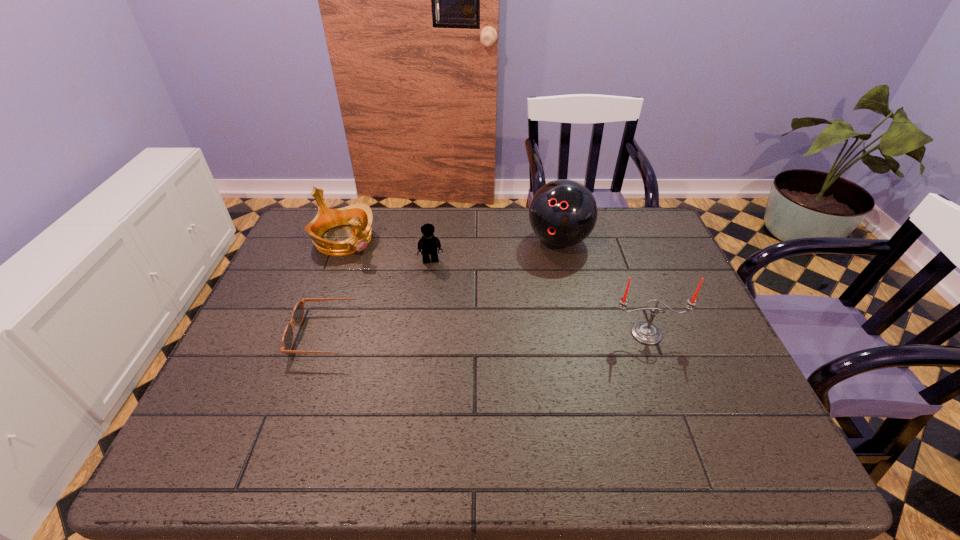
Where is `vacant space that satisfies the following two spatial constraints: 1. on the front side of the bowling ball; 2. on the right side of the tiara`? Image resolution: width=960 pixels, height=540 pixels. vacant space that satisfies the following two spatial constraints: 1. on the front side of the bowling ball; 2. on the right side of the tiara is located at coordinates (344, 240).

Identify the location of vacant region that satisfies the following two spatial constraints: 1. on the back side of the third object from right to left; 2. on the left side of the bowling ball. (434, 240).